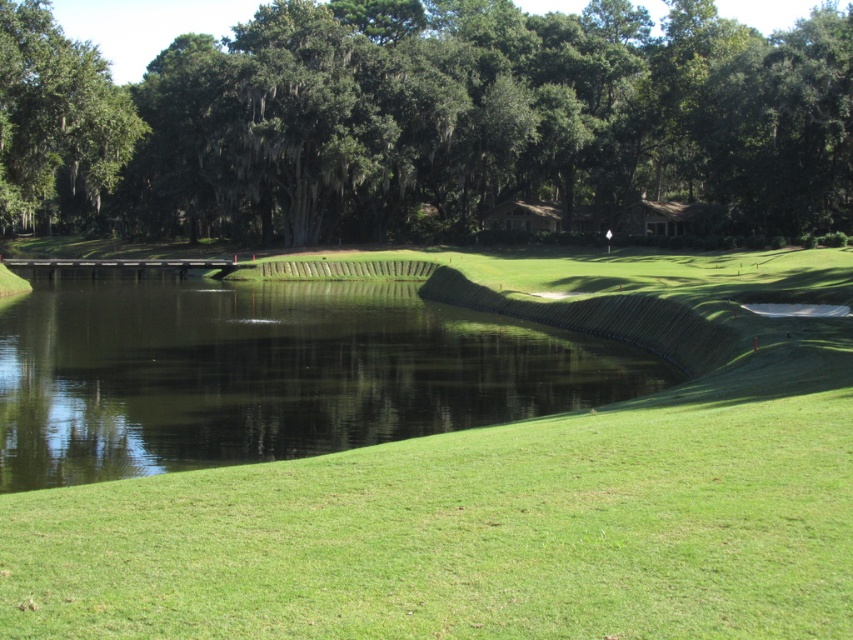
Consider the image. You are a golfer standing at the tee and want to hit the ball to the green area. There is a point marked at coordinates (x=425, y=120) on the map. What is located at that point?

The point marked at coordinates (x=425, y=120) indicates the location of a green leafy tree at upper center.

You are a golfer standing on the green grassy bank at lower left, aiming to hit a ball towards the green leafy tree at upper left. If your maximum driving distance is 25 meters, will you be able to reach the tree with one shot?

The green grassy bank at lower left is 26.86 meters from the green leafy tree at upper left. Since your maximum driving distance is 25 meters, you will not be able to reach the tree with one shot.

You are a golfer standing on the green grassy bank at lower left and want to hit the ball to the green leafy tree at upper center. In which direction should you aim your shot?

You should aim to the right because the green leafy tree at upper center is to the left of the green grassy bank at lower left, so to reach it from the bank, you need to hit the ball in the direction opposite to its current position relative to the bank.